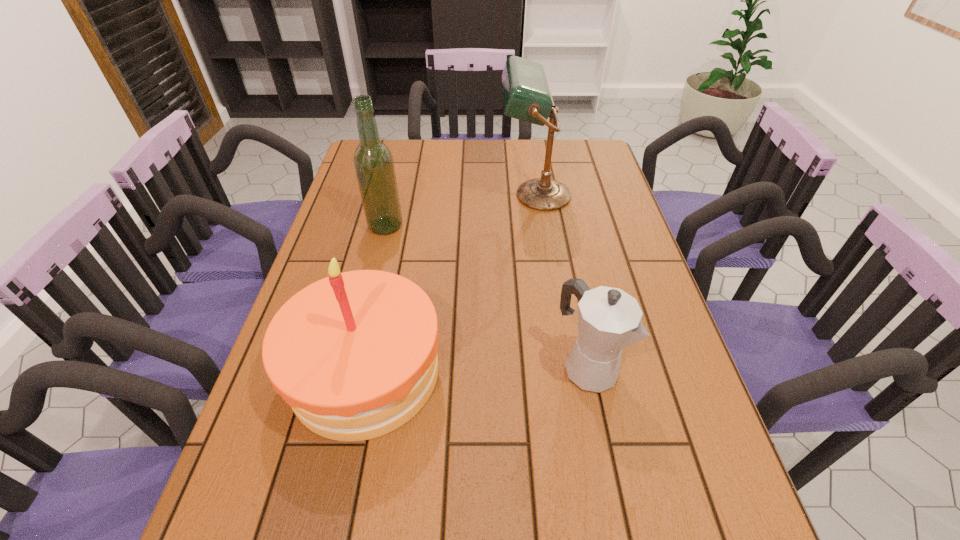
At what (x,y) coordinates should I click in order to perform the action: click on the second closest object to the third tallest object. Please return your answer as a coordinate pair (x, y). Looking at the image, I should click on (374, 166).

Image resolution: width=960 pixels, height=540 pixels. In order to click on vacant space that satisfies the following two spatial constraints: 1. on the front side of the liquor; 2. on the left side of the coffeepot in this screenshot , I will do `click(351, 366)`.

You are a GUI agent. You are given a task and a screenshot of the screen. Output one action in this format:
    pyautogui.click(x=<x>, y=<y>)
    Task: Click on the vacant space that satisfies the following two spatial constraints: 1. above the green lampshade of the table lamp; 2. on the front side of the second shortest object
    The image size is (960, 540).
    Given the screenshot: What is the action you would take?
    pyautogui.click(x=562, y=372)

This screenshot has height=540, width=960. I want to click on blank area in the image that satisfies the following two spatial constraints: 1. above the green lampshade of the table lamp; 2. on the right side of the coffeepot, so click(561, 366).

Find the location of `vacant region that satisfies the following two spatial constraints: 1. above the green lampshade of the table lamp; 2. on the back side of the coffeepot`. vacant region that satisfies the following two spatial constraints: 1. above the green lampshade of the table lamp; 2. on the back side of the coffeepot is located at coordinates point(561,366).

Where is `free space in the image that satisfies the following two spatial constraints: 1. above the green lampshade of the shortest object; 2. on the right side of the table lamp`? The height and width of the screenshot is (540, 960). free space in the image that satisfies the following two spatial constraints: 1. above the green lampshade of the shortest object; 2. on the right side of the table lamp is located at coordinates (561, 366).